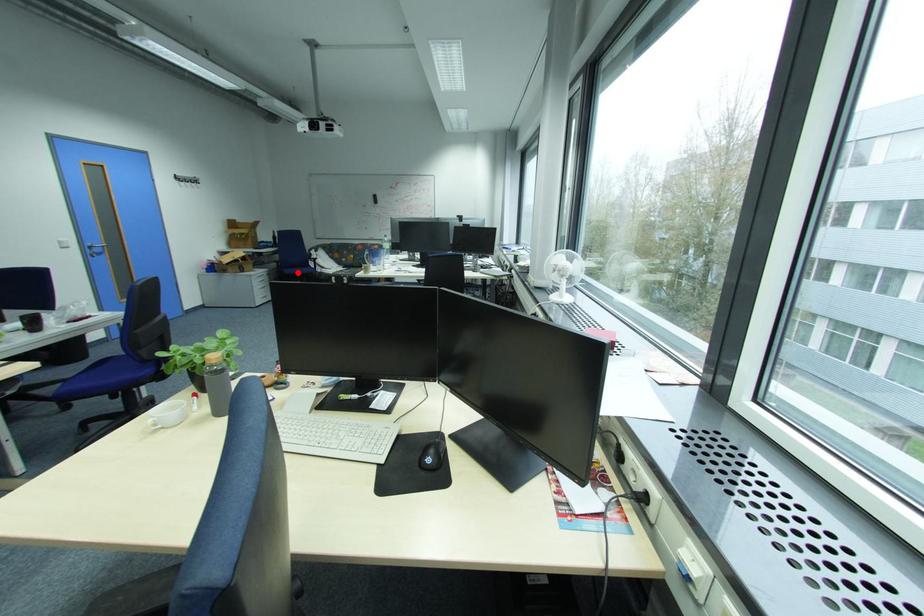
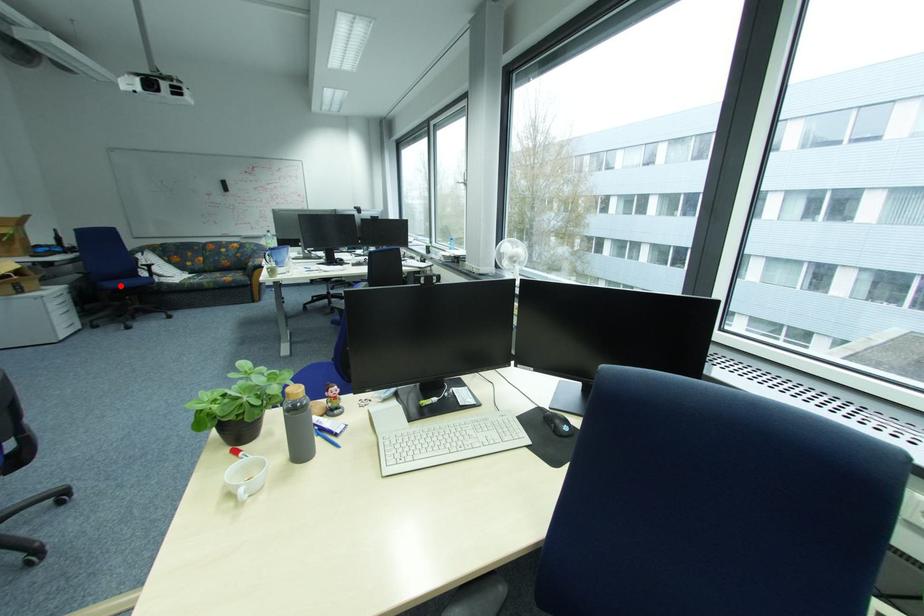
I am providing you with two images of the same scene from different viewpoints. A red point is marked on the first image and another point is marked on the second image. Does the point marked in image1 correspond to the same location as the one in image2?

Yes